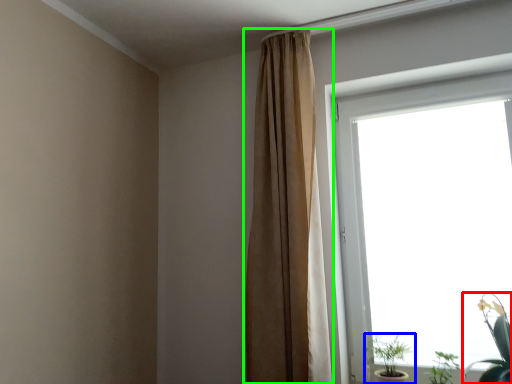
Question: Which object is positioned farthest from houseplant (highlighted by a red box)? Select from houseplant (highlighted by a blue box) and curtain (highlighted by a green box).

Choices:
 (A) houseplant
 (B) curtain

Answer: (B)